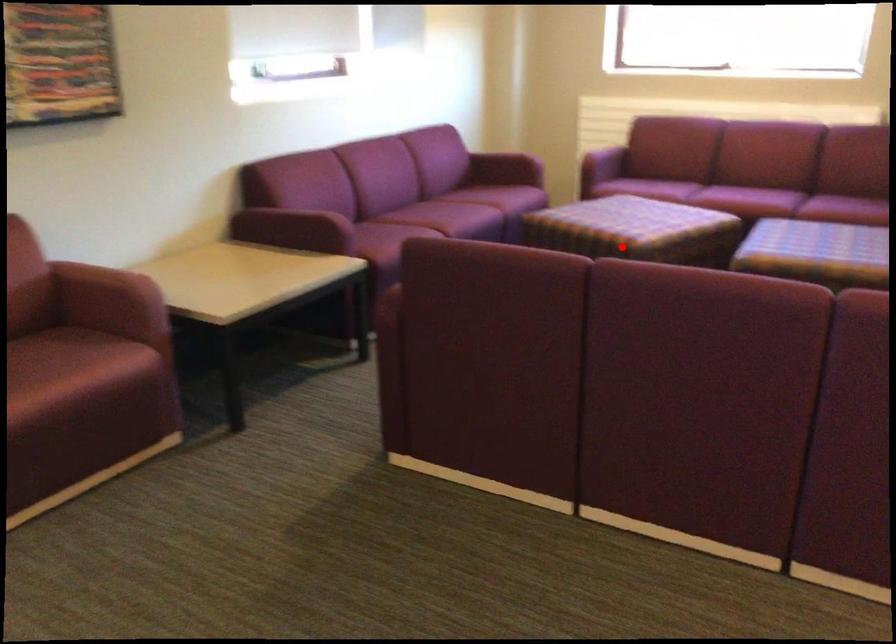
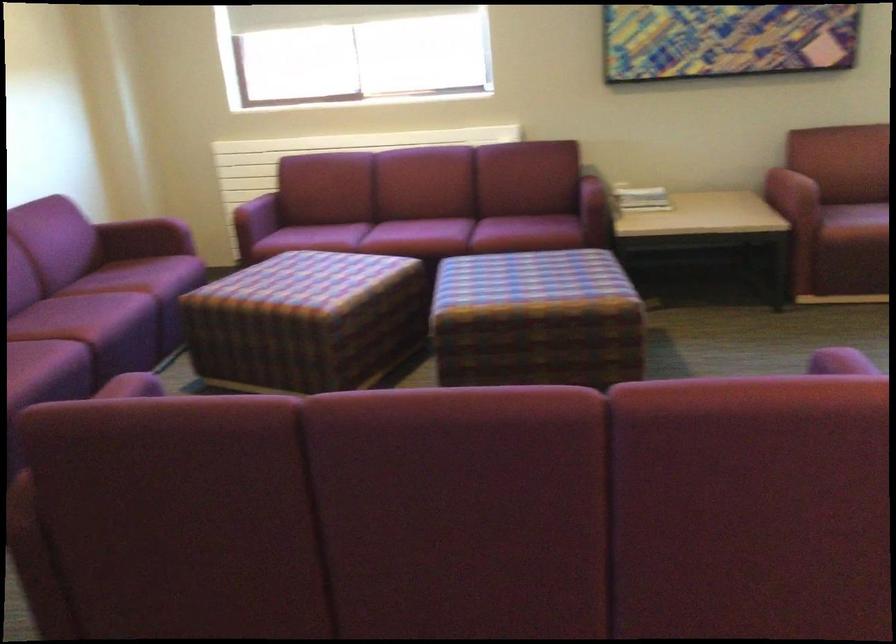
Question: I am providing you with two images of the same scene from different viewpoints. A red point is shown in image1. For the corresponding object point in image2, is it positioned nearer or farther from the camera?

Choices:
 (A) Nearer
 (B) Farther

Answer: (A)